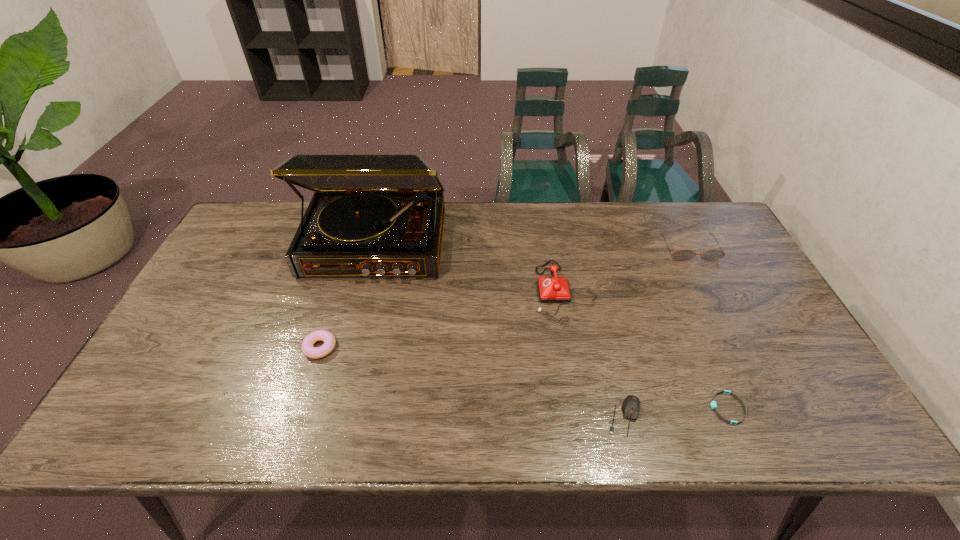
Find the location of a particular element. The width and height of the screenshot is (960, 540). wristband that is at the near edge is located at coordinates (713, 404).

At what (x,y) coordinates should I click in order to perform the action: click on object present at the right edge. Please return your answer as a coordinate pair (x, y). The width and height of the screenshot is (960, 540). Looking at the image, I should click on (681, 255).

The image size is (960, 540). I want to click on object that is at the far right corner, so [681, 255].

Identify the location of vacant area at the far edge. (559, 220).

The width and height of the screenshot is (960, 540). Identify the location of vacant space at the near edge of the desktop. (480, 411).

Find the location of `vacant space at the left edge of the desktop`. vacant space at the left edge of the desktop is located at coordinates (132, 397).

This screenshot has width=960, height=540. In order to click on vacant space at the right edge in this screenshot , I will do `click(735, 332)`.

Locate an element on the screen. free space at the far left corner is located at coordinates (280, 226).

In the image, there is a desktop. Where is `vacant space at the near left corner`? vacant space at the near left corner is located at coordinates (139, 422).

In the image, there is a desktop. Identify the location of vacant space at the near right corner. (831, 413).